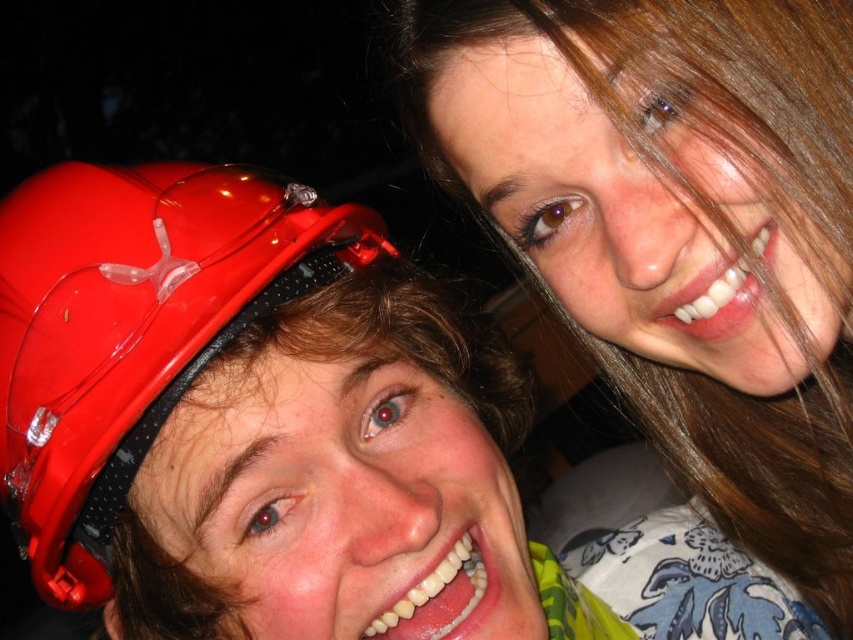
Based on the photo, you are a photographer trying to adjust the lighting to highlight the shiny brown hair at upper right and the matte plastic helmet at left. Since the background is dark, which object should you focus the light on to make sure both are visible?

The shiny brown hair at upper right is positioned over the matte plastic helmet at left. To ensure both are visible, focus the light on the shiny brown hair at upper right because it is closer to the camera and will reflect more light, while the matte plastic helmet at left may require less direct light to avoid overexposure.

You are standing at the point marked as point (x=822, y=396) and want to take a photo of the two people in the scene. The camera you have can only focus on subjects within 25 inches. Will the camera be able to focus on the two people?

The point marked as point (x=822, y=396) and the camera are 28.26 inches apart. Since the camera can only focus within 25 inches, the distance is too great for the camera to focus on the two people.

You are a photographer trying to adjust the lighting to highlight both the shiny brown hair at upper right and the matte plastic helmet at left. Since the background is dark, you want to ensure neither object is obscured. Based on their positions, which object might require more focused lighting to be clearly visible?

The matte plastic helmet at left is behind shiny brown hair at upper right, so it might require more focused lighting to ensure it stands out against the dark background and isn not obscured by the hair in front of it.